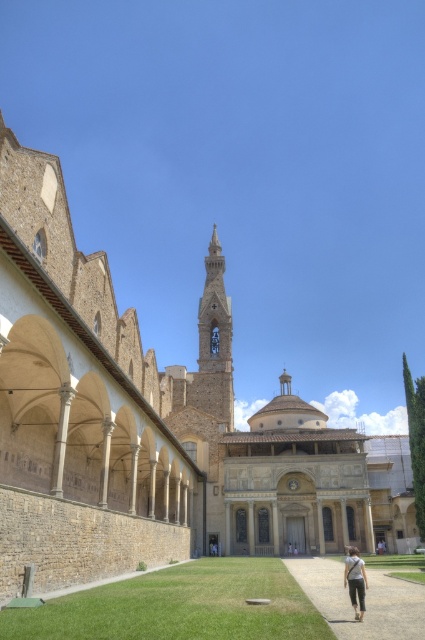
Question: Does gravel path at center have a greater width compared to smooth stone tower at center?

Choices:
 (A) no
 (B) yes

Answer: (B)

Question: Does green grass at lower center have a smaller size compared to light brown fabric pants at lower right?

Choices:
 (A) no
 (B) yes

Answer: (B)

Question: Among these points, which one is nearest to the camera?

Choices:
 (A) (303, 634)
 (B) (404, 602)
 (C) (221, 326)
 (D) (357, 611)

Answer: (A)

Question: Which point is farther to the camera?

Choices:
 (A) green grass at lower center
 (B) light brown fabric pants at lower right
 (C) smooth stone tower at center

Answer: (C)

Question: Which point is closer to the camera taking this photo?

Choices:
 (A) (408, 618)
 (B) (198, 592)
 (C) (215, 387)

Answer: (A)

Question: Is smooth stone tower at center to the left of light brown fabric pants at lower right from the viewer's perspective?

Choices:
 (A) yes
 (B) no

Answer: (A)